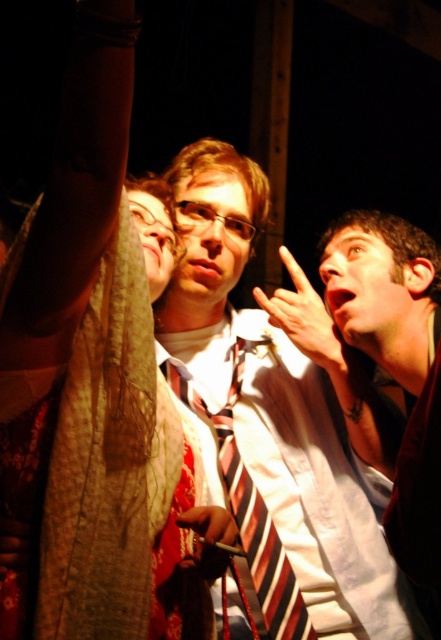
Which is more to the right, striped fabric tie at center or smooth skin hand at upper right?

smooth skin hand at upper right

Which is below, striped fabric tie at center or smooth skin hand at upper right?

Positioned lower is striped fabric tie at center.

Is point (195, 396) in front of point (346, 369)?

No.

I want to click on striped fabric tie at center, so click(250, 513).

Is point (191, 364) positioned in front of point (239, 387)?

No, it is behind (239, 387).

Is striped tie at center to the left of striped fabric tie at center from the viewer's perspective?

No, striped tie at center is not to the left of striped fabric tie at center.

Locate an element on the screen. striped tie at center is located at coordinates (272, 422).

Which is behind, point (271, 545) or point (194, 513)?

The point (271, 545) is behind.

Looking at this image, is striped fabric tie at center above smooth leather handbag at center?

Indeed, striped fabric tie at center is positioned over smooth leather handbag at center.

Locate an element on the screen. The height and width of the screenshot is (640, 441). striped fabric tie at center is located at coordinates (250, 513).